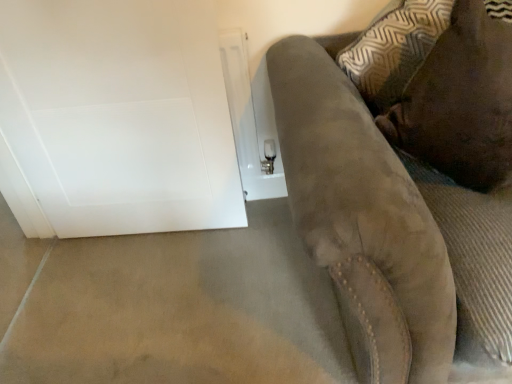
I want to click on free region on the left part of white glossy door at left, so click(67, 270).